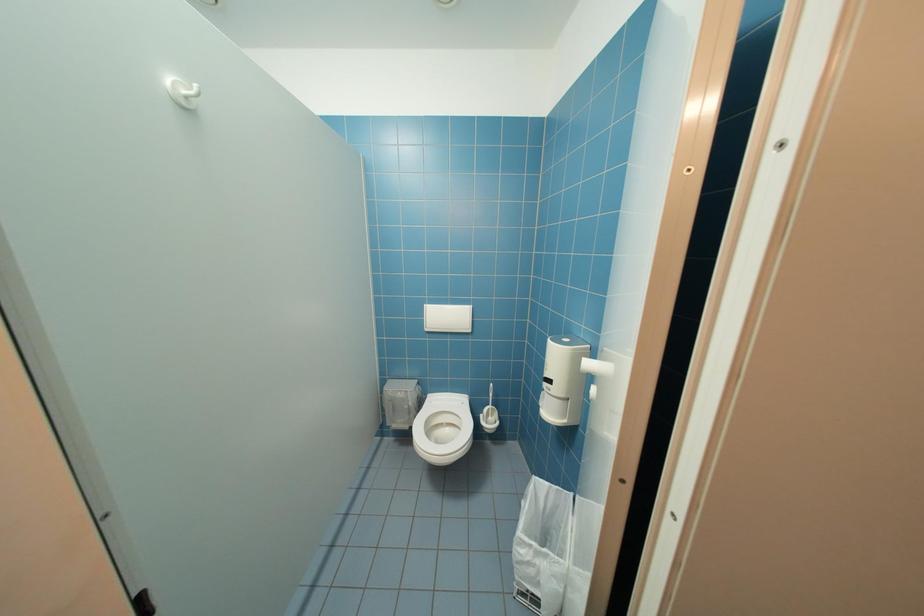
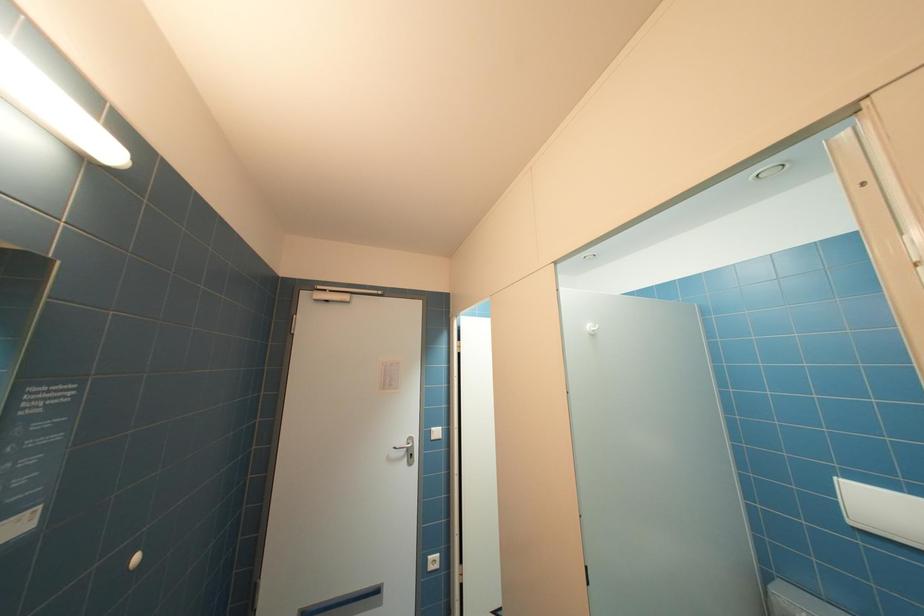
The images are taken continuously from a first-person perspective. In which direction is your viewpoint rotating?

The rotation direction of the camera is left-up.